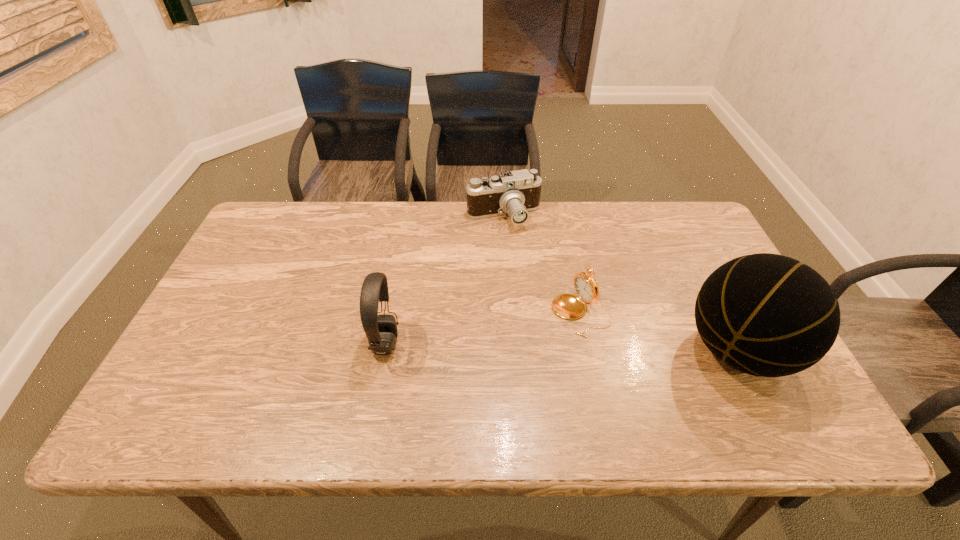
Find the location of a particular element. The image size is (960, 540). vacant space on the desktop that is between the headset and the basketball and is positioned on the face of the pocket watch is located at coordinates (510, 346).

At what (x,y) coordinates should I click in order to perform the action: click on free space on the desktop that is between the third shortest object and the basketball and is positioned at the lens of the farthest object. Please return your answer as a coordinate pair (x, y). The image size is (960, 540). Looking at the image, I should click on (533, 346).